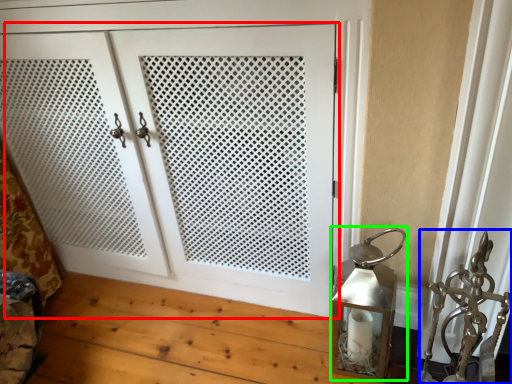
Question: Which object is the closest to the door (highlighted by a red box)? Choose among these: sculpture (highlighted by a blue box) or table lamp (highlighted by a green box).

Choices:
 (A) sculpture
 (B) table lamp

Answer: (B)